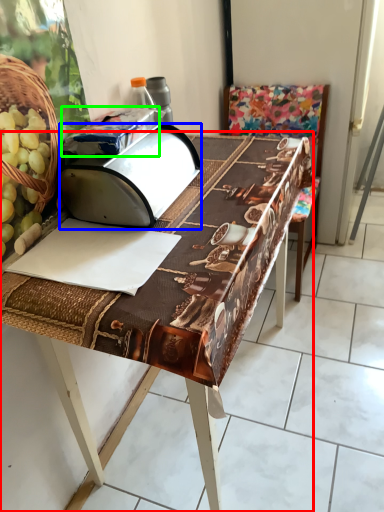
Question: Based on their relative distances, which object is farther from table (highlighted by a red box)? Choose from wide (highlighted by a blue box) and wrapping paper (highlighted by a green box).

Choices:
 (A) wide
 (B) wrapping paper

Answer: (B)